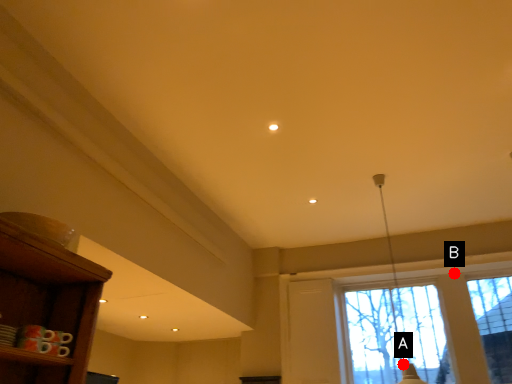
Question: Two points are circled on the image, labeled by A and B beside each circle. Which point appears farthest from the camera in this image?

Choices:
 (A) A is further
 (B) B is further

Answer: (A)